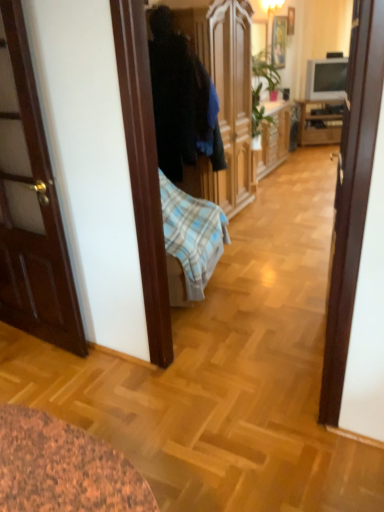
Question: Is wooden picture frame at upper center, which ranks as the second picture frame in right-to-left order, bigger or smaller than matte gray tv at upper right?

Choices:
 (A) big
 (B) small

Answer: (A)

Question: From the image's perspective, is wooden picture frame at upper center, which ranks as the second picture frame in right-to-left order, located above or below matte gray tv at upper right?

Choices:
 (A) above
 (B) below

Answer: (A)

Question: Estimate the real-world distances between objects in this image. Which object is closer to the matte white lampshade at upper center?

Choices:
 (A) matte gray tv at upper right
 (B) wooden picture frame at upper center, which ranks as the second picture frame in right-to-left order
 (C) dark fabric coat at center
 (D) wooden picture frame at upper center, which is counted as the 1th picture frame, starting from the right
 (E) wooden cabinet at right

Answer: (B)

Question: Estimate the real-world distances between objects in this image. Which object is closer to the wooden picture frame at upper center, which is counted as the 1th picture frame, starting from the right?

Choices:
 (A) matte gray tv at upper right
 (B) wooden picture frame at upper center, which ranks as the second picture frame in right-to-left order
 (C) wooden cabinet at right
 (D) matte white lampshade at upper center
 (E) dark fabric coat at center

Answer: (B)